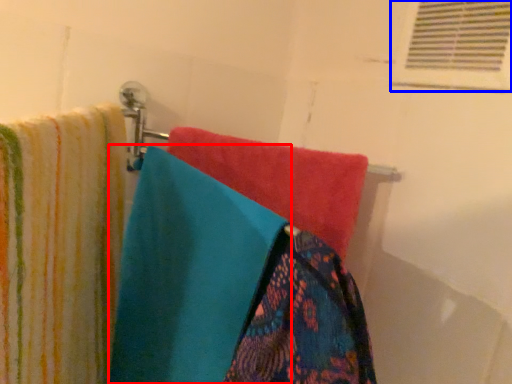
Question: Which of the following is the farthest to the observer, towel (highlighted by a red box) or shutter (highlighted by a blue box)?

Choices:
 (A) towel
 (B) shutter

Answer: (B)